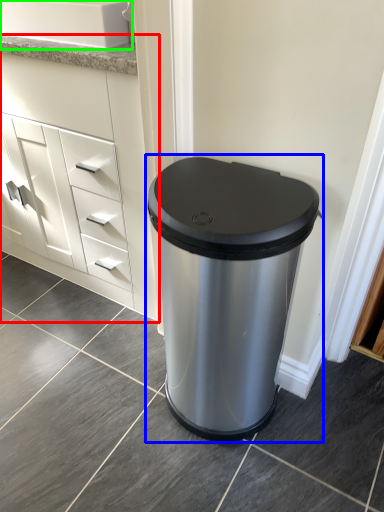
Question: Which is nearer to the chest of drawers (highlighted by a red box)? waste container (highlighted by a blue box) or sink (highlighted by a green box).

Choices:
 (A) waste container
 (B) sink

Answer: (B)